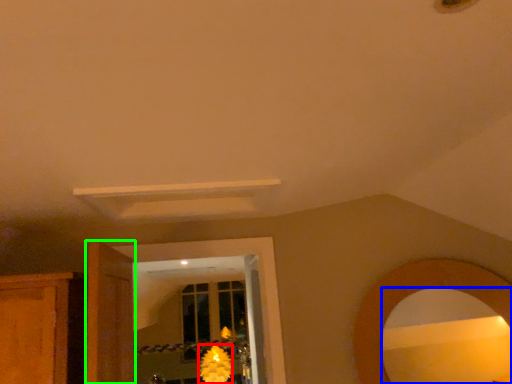
Question: Which is nearer to the flower (highlighted by a red box)? mirror (highlighted by a blue box) or door (highlighted by a green box).

Choices:
 (A) mirror
 (B) door

Answer: (B)